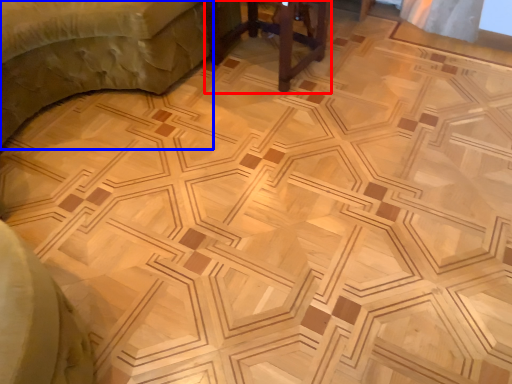
Question: Which point is further to the camera, furniture (highlighted by a red box) or furniture (highlighted by a blue box)?

Choices:
 (A) furniture
 (B) furniture

Answer: (A)